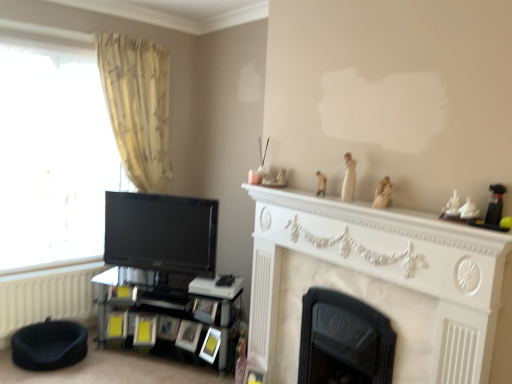
Where is `free space between matte yellow picture frame at lower center, which is the 1th picture frame in front-to-back order, and dark blue fabric bean bag chair at lower left`? This screenshot has width=512, height=384. free space between matte yellow picture frame at lower center, which is the 1th picture frame in front-to-back order, and dark blue fabric bean bag chair at lower left is located at coordinates (138, 360).